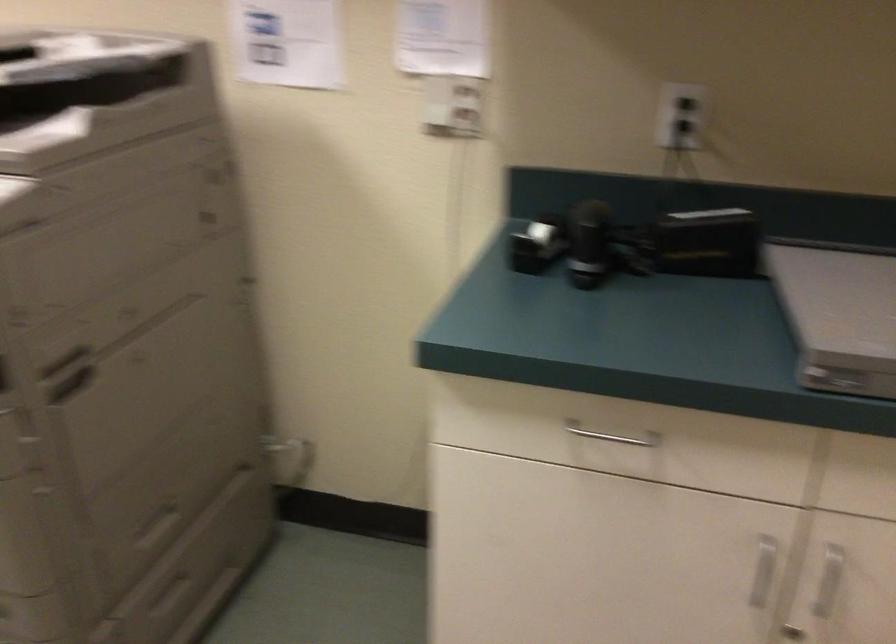
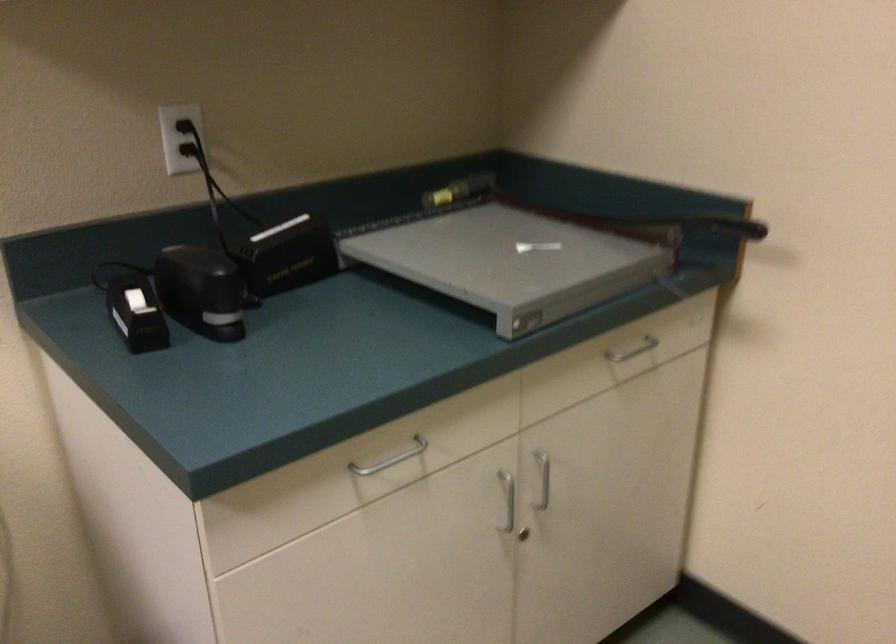
In the second image, find the point that corresponds to (x=687, y=102) in the first image.

(186, 128)